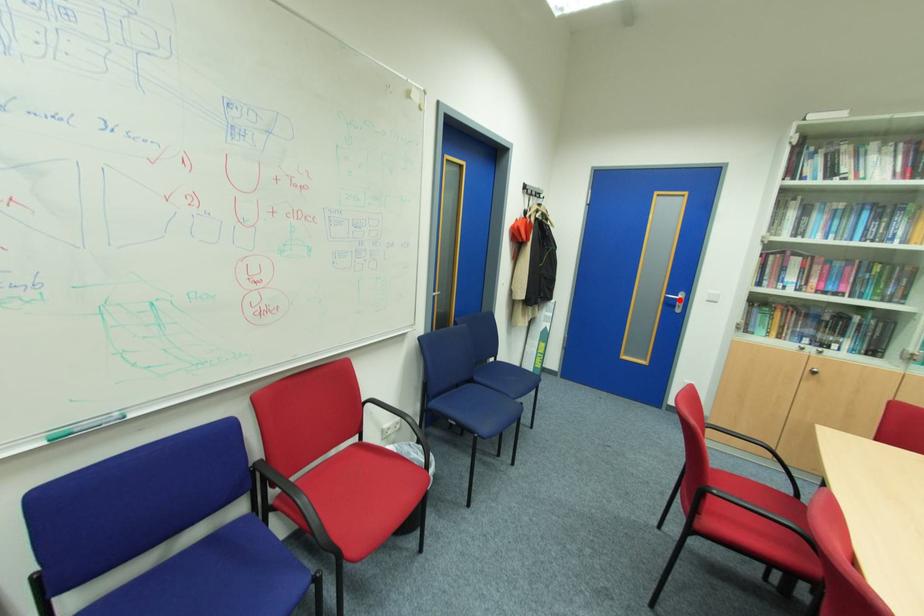
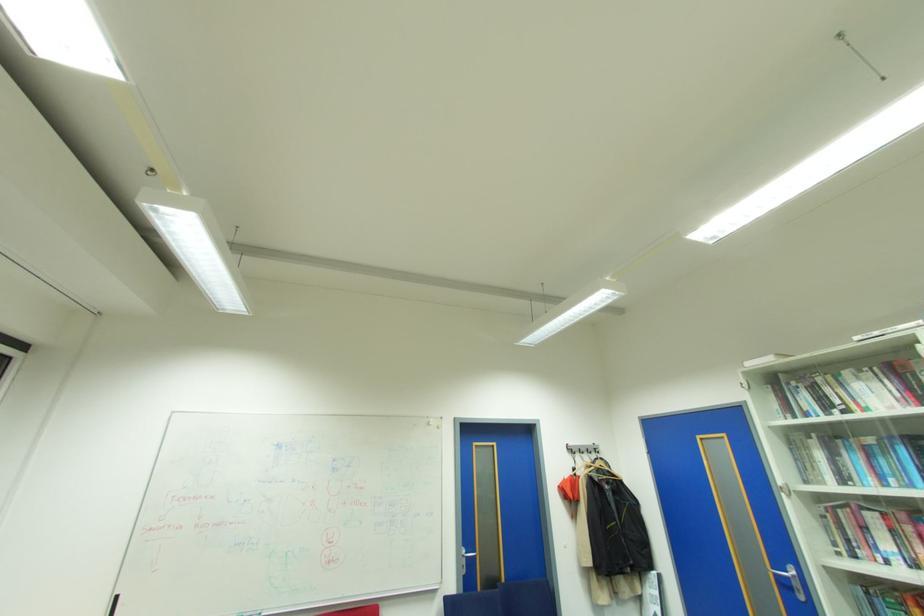
Question: I am providing you with two images of the same scene from different viewpoints. Image1 has a red point marked. In image2, the corresponding 3D location appears at what relative position? Reply with the corresponding letter.

Choices:
 (A) Closer
 (B) Farther

Answer: (A)